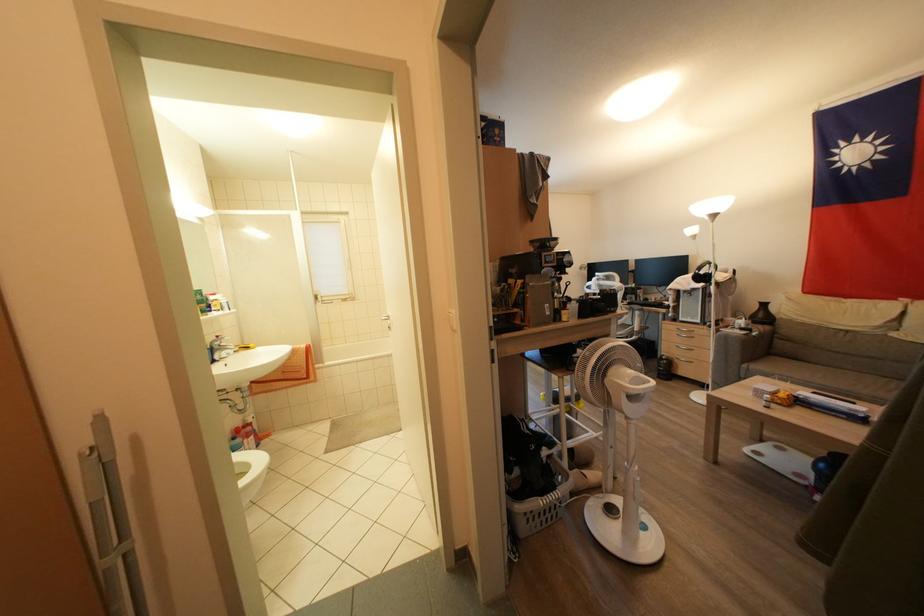
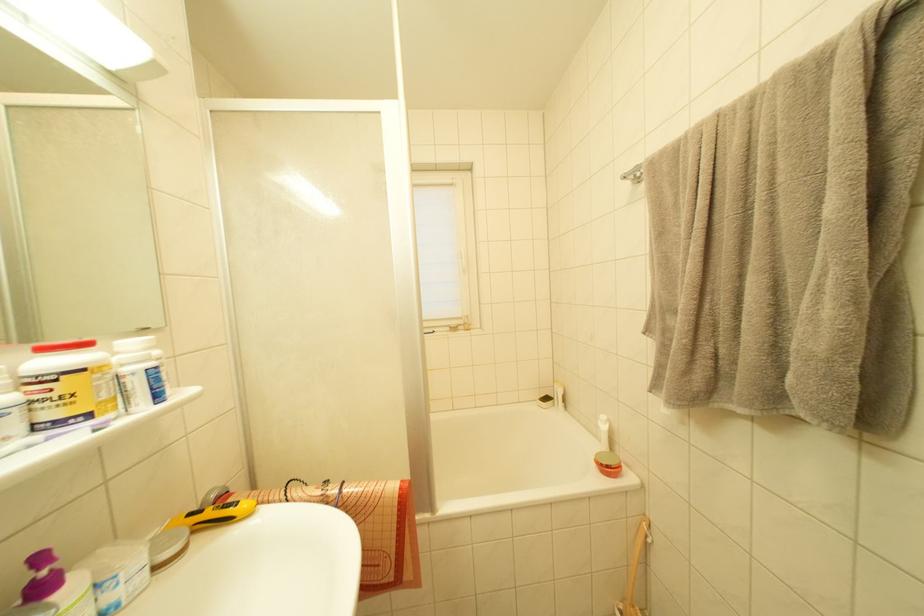
What movement of the cameraman would produce the second image?

The cameraman moved toward left, forward.